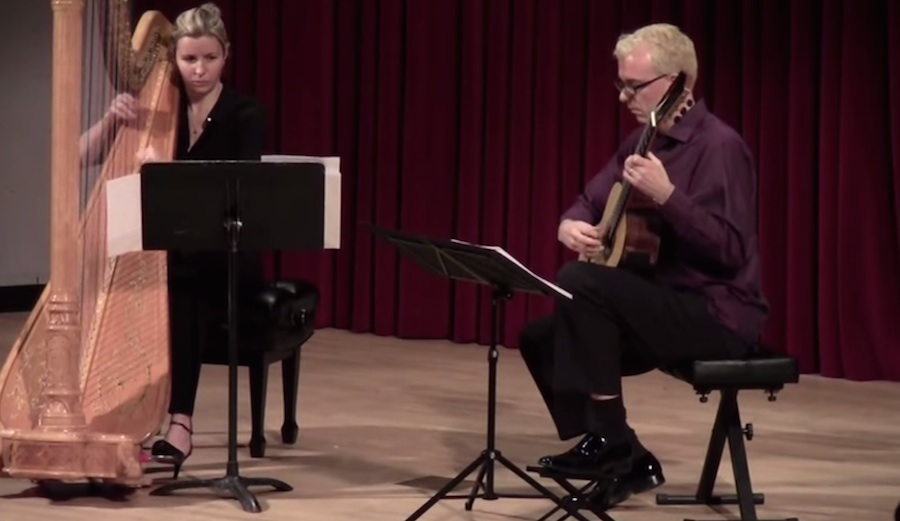
The width and height of the screenshot is (900, 521). I want to click on red carpet, so click(x=832, y=314).